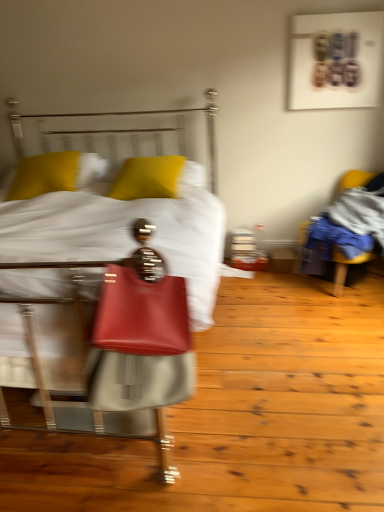
Question: Is matte red handbag at center directly adjacent to yellow fabric chair at right?

Choices:
 (A) yes
 (B) no

Answer: (B)

Question: Is matte red handbag at center in front of yellow fabric chair at right?

Choices:
 (A) yes
 (B) no

Answer: (A)

Question: Considering the relative sizes of matte red handbag at center and yellow fabric chair at right in the image provided, is matte red handbag at center shorter than yellow fabric chair at right?

Choices:
 (A) yes
 (B) no

Answer: (A)

Question: Is matte red handbag at center facing towards yellow fabric chair at right?

Choices:
 (A) yes
 (B) no

Answer: (B)

Question: Can you confirm if matte red handbag at center is positioned to the right of yellow fabric chair at right?

Choices:
 (A) yes
 (B) no

Answer: (B)

Question: From a real-world perspective, is yellow fabric chair at right above or below matte leather bed at center?

Choices:
 (A) above
 (B) below

Answer: (B)

Question: Considering the positions of yellow fabric chair at right and matte leather bed at center in the image, is yellow fabric chair at right bigger or smaller than matte leather bed at center?

Choices:
 (A) big
 (B) small

Answer: (B)

Question: In the image, is yellow fabric chair at right positioned in front of or behind matte leather bed at center?

Choices:
 (A) behind
 (B) front

Answer: (A)

Question: Choose the correct answer: Is yellow fabric chair at right inside matte leather bed at center or outside it?

Choices:
 (A) outside
 (B) inside

Answer: (A)

Question: Is point (109, 295) positioned closer to the camera than point (82, 364)?

Choices:
 (A) closer
 (B) farther

Answer: (A)

Question: From a real-world perspective, is matte red handbag at center positioned above or below matte leather bed at center?

Choices:
 (A) below
 (B) above

Answer: (B)

Question: In terms of size, does matte red handbag at center appear bigger or smaller than matte leather bed at center?

Choices:
 (A) small
 (B) big

Answer: (A)

Question: From their relative heights in the image, would you say matte red handbag at center is taller or shorter than matte leather bed at center?

Choices:
 (A) tall
 (B) short

Answer: (B)

Question: From the image's perspective, relative to yellow matte pillow at upper left, marked as the 1th pillow in a left-to-right arrangement, is matte leather bed at center above or below?

Choices:
 (A) below
 (B) above

Answer: (A)

Question: From their relative heights in the image, would you say matte leather bed at center is taller or shorter than yellow matte pillow at upper left, which appears as the 2th pillow when viewed from the right?

Choices:
 (A) tall
 (B) short

Answer: (A)